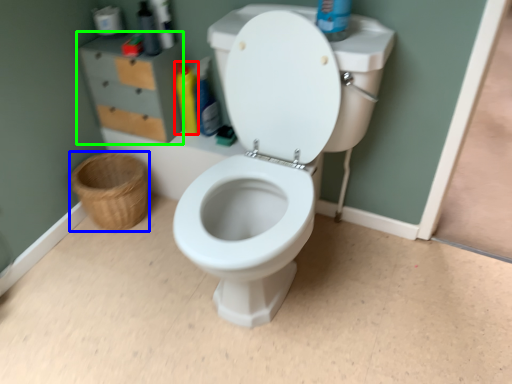
Question: Which is nearer to the cleaning product (highlighted by a red box)? basket (highlighted by a blue box) or file cabinet (highlighted by a green box).

Choices:
 (A) basket
 (B) file cabinet

Answer: (B)